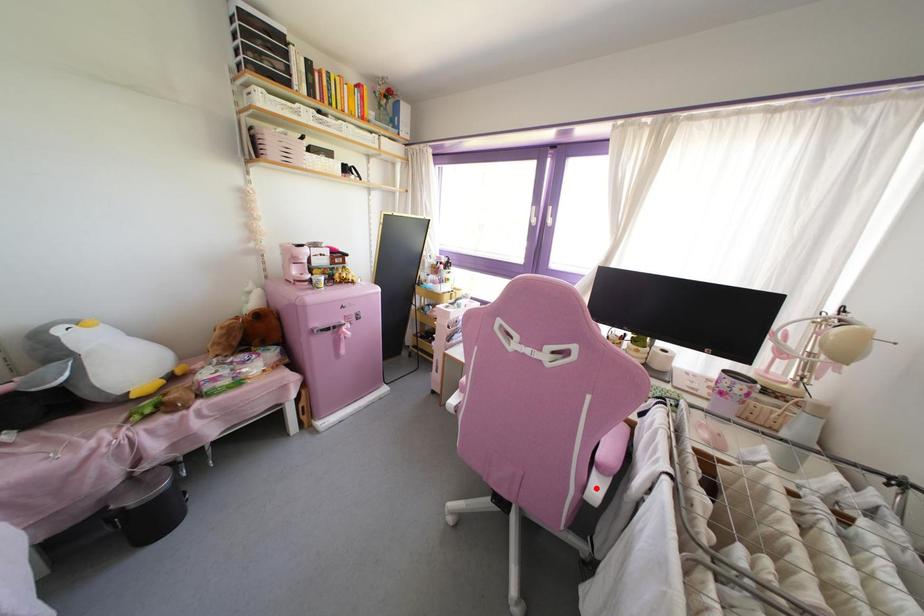
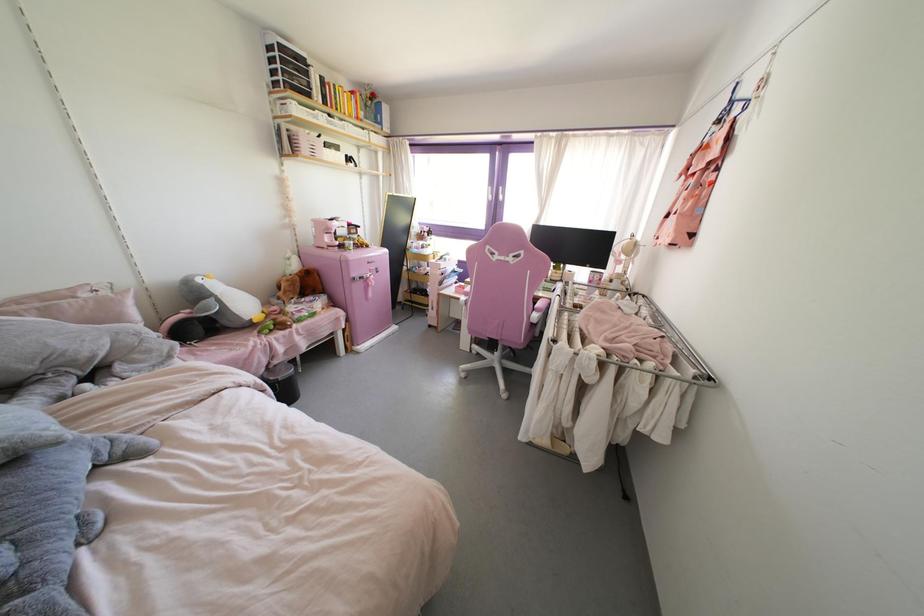
Find the pixel in the second image that matches the highlighted location in the first image.

(535, 315)